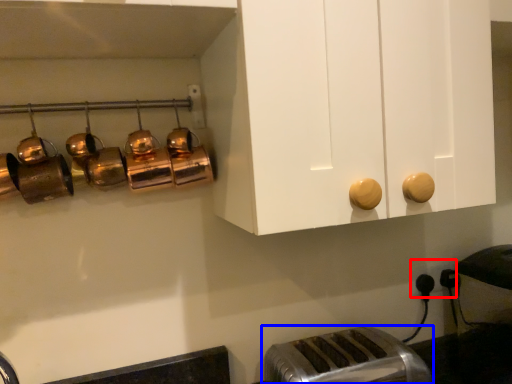
Question: Which object is further to the camera taking this photo, electric outlet (highlighted by a red box) or toaster (highlighted by a blue box)?

Choices:
 (A) electric outlet
 (B) toaster

Answer: (A)